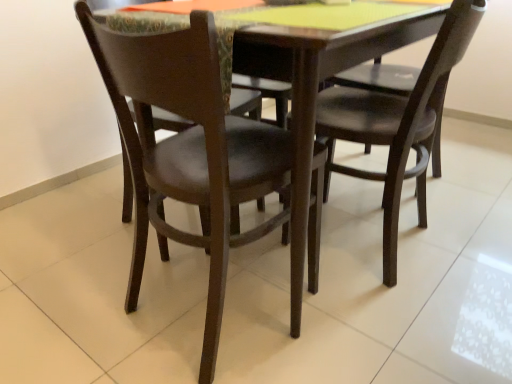
In order to click on vacant area that lies in front of matte black chair at center, which ranks as the second chair in left-to-right order in this screenshot , I will do `click(424, 324)`.